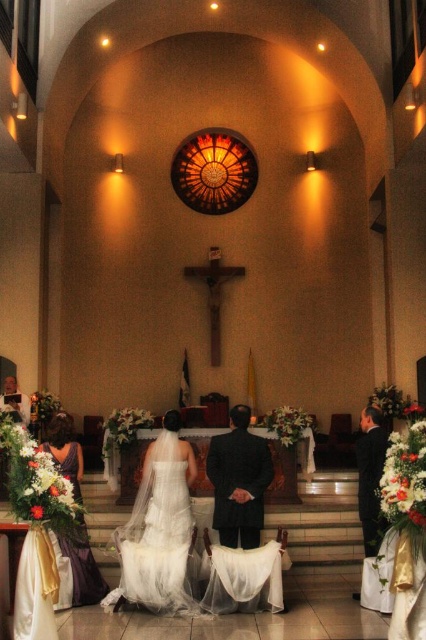
In the scene shown: Who is taller, dark suit at right or smooth white shirt at lower left?

dark suit at right is taller.

Who is positioned more to the left, dark suit at right or smooth white shirt at lower left?

Positioned to the left is smooth white shirt at lower left.

Does point (368, 547) come closer to viewer compared to point (11, 410)?

Yes, point (368, 547) is in front of point (11, 410).

Find the location of a particular element. dark suit at right is located at coordinates (371, 476).

Can you confirm if dark suit at center is thinner than satin purple dress at lower left?

Yes.

Between dark suit at center and satin purple dress at lower left, which one is positioned higher?

dark suit at center is higher up.

Is point (227, 500) positioned before point (92, 572)?

That is False.

The image size is (426, 640). I want to click on dark suit at center, so click(x=238, y=481).

Between white satin dress at center and dark suit at center, which one appears on the left side from the viewer's perspective?

Positioned to the left is white satin dress at center.

Between white satin dress at center and dark suit at center, which one has less height?

With less height is dark suit at center.

Who is more forward, (189, 504) or (267, 449)?

Point (267, 449) is in front.

In order to click on white satin dress at center in this screenshot , I will do `click(158, 529)`.